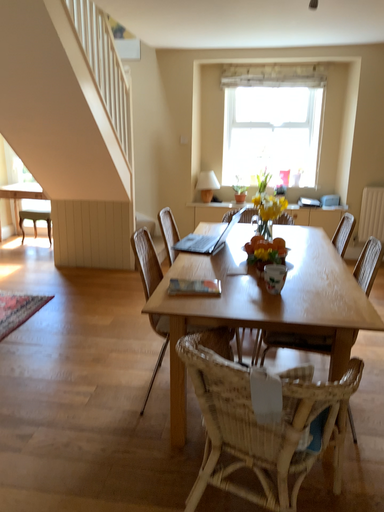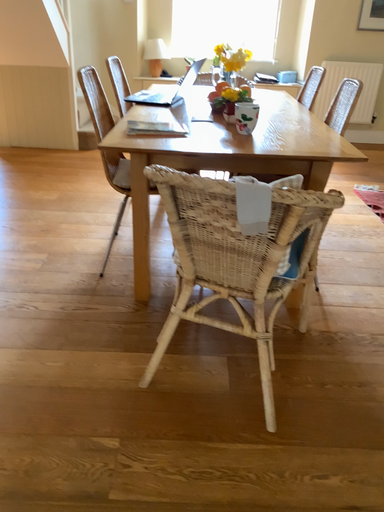
Question: Which way did the camera rotate in the video?

Choices:
 (A) rotated downward
 (B) rotated upward

Answer: (A)